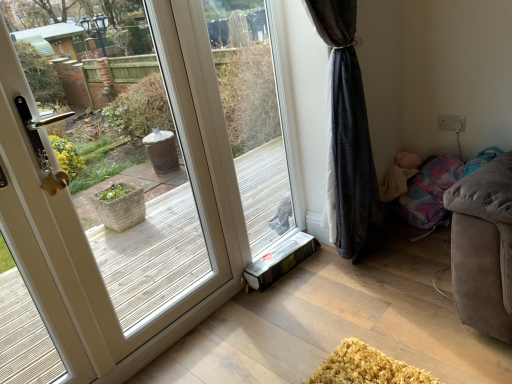
Question: From their relative heights in the image, would you say white glossy door at left is taller or shorter than transparent glass window at center?

Choices:
 (A) short
 (B) tall

Answer: (B)

Question: From the image's perspective, relative to transparent glass window at center, is white glossy door at left above or below?

Choices:
 (A) below
 (B) above

Answer: (A)

Question: Estimate the real-world distances between objects in this image. Which object is farther from the soft beige blanket at lower right?

Choices:
 (A) white glossy door at left
 (B) transparent glass window at center

Answer: (A)

Question: Which is farther from the transparent glass window at center?

Choices:
 (A) soft beige blanket at lower right
 (B) white glossy door at left

Answer: (B)